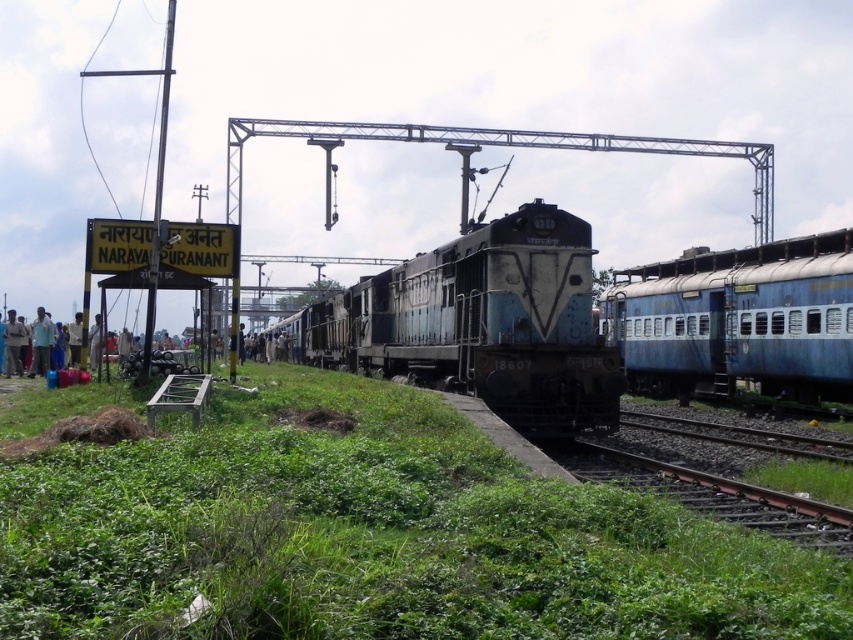
You are a photographer standing at the railway station. You want to capture both the dirty metallic train at center and the blue painted metal passenger train at right in the same frame. Considering their heights, which train should you position closer to the camera to ensure both are fully visible?

The dirty metallic train at center has a lesser height compared to the blue painted metal passenger train at right. To ensure both are fully visible, position the shorter dirty metallic train at center closer to the camera so that the taller blue painted metal passenger train at right can be captured without being cut off.

You are a photographer standing at the railway station. You want to take a photo of both point (474, 330) and point (628, 468) in the image. Which point should you focus on first to ensure both are in sharp focus?

You should focus on point (628, 468) first because it is closer to the camera than point (474, 330). By focusing on the closer point, the farther point will also be within the depth of field and appear sharp.

You are standing at the point marked as point [482,323] in the image. What object is located exactly at your current position?

The dirty metallic train at center is located exactly at point [482,323].